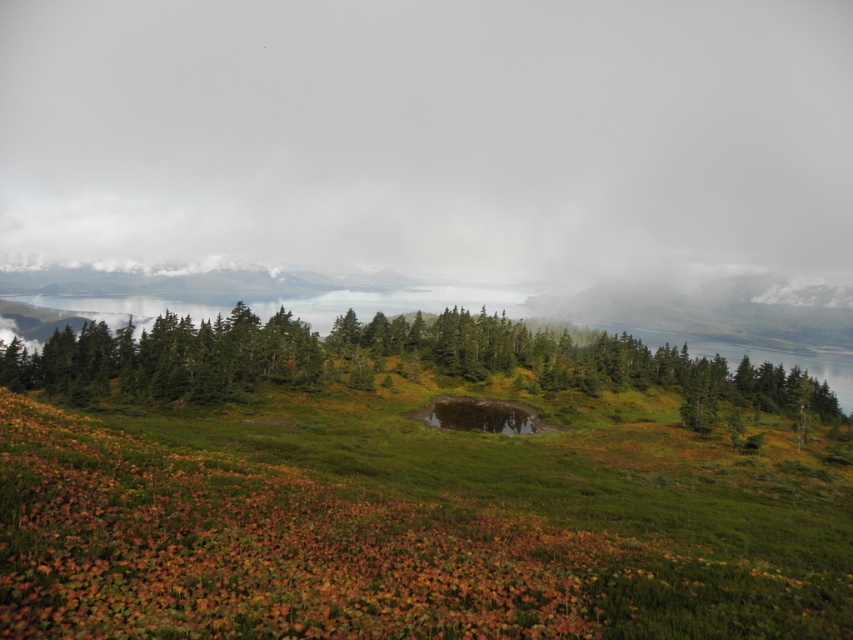
Is green grassy at center positioned in front of green matte trees at center?

That is True.

Between green grassy at center and green matte trees at center, which one has less height?

green grassy at center

Between point (582, 547) and point (73, 381), which one is positioned in front?

Positioned in front is point (582, 547).

Find the location of `green grassy at center`. green grassy at center is located at coordinates [x=408, y=525].

Can you confirm if white fluffy cloud at upper center is shorter than green grassy at center?

No.

Consider the image. Can you confirm if white fluffy cloud at upper center is positioned to the right of green grassy at center?

Incorrect, white fluffy cloud at upper center is not on the right side of green grassy at center.

The width and height of the screenshot is (853, 640). Identify the location of white fluffy cloud at upper center. (430, 140).

Between white fluffy cloud at upper center and green matte trees at center, which one appears on the left side from the viewer's perspective?

green matte trees at center is more to the left.

Is point (144, 124) closer to viewer compared to point (757, 406)?

No.

Locate an element on the screen. The height and width of the screenshot is (640, 853). white fluffy cloud at upper center is located at coordinates (430, 140).